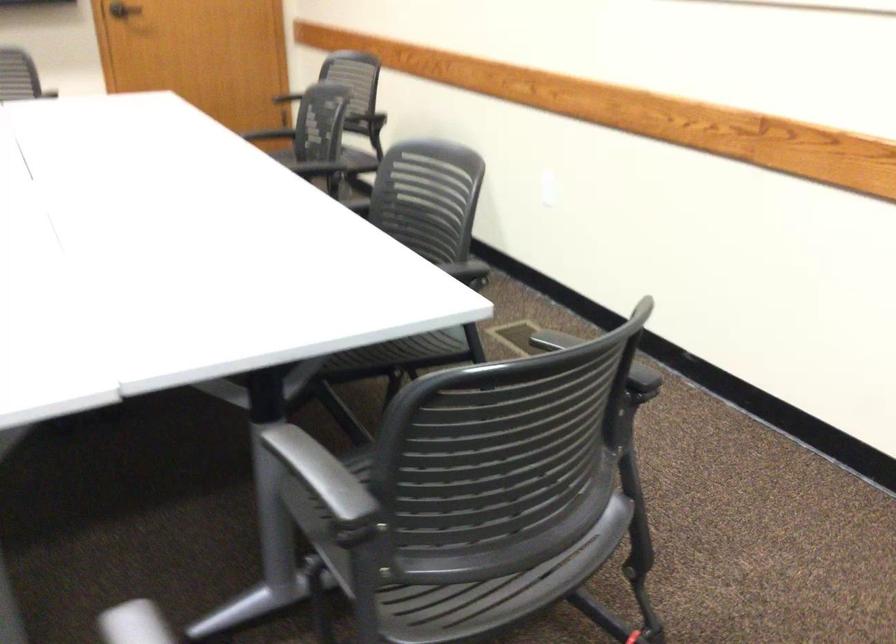
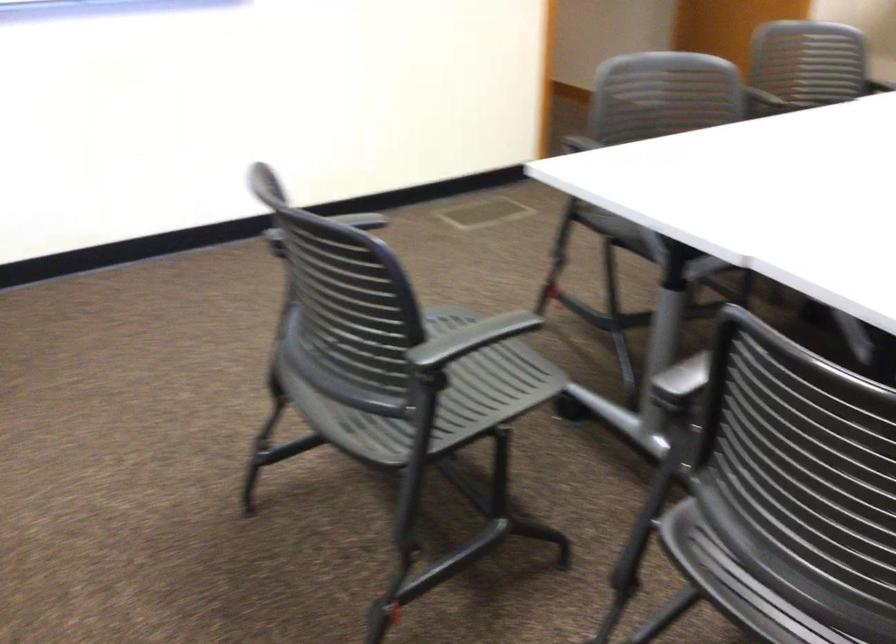
Based on the continuous images, in which direction is the camera rotating?

The camera's rotation is toward left-down.